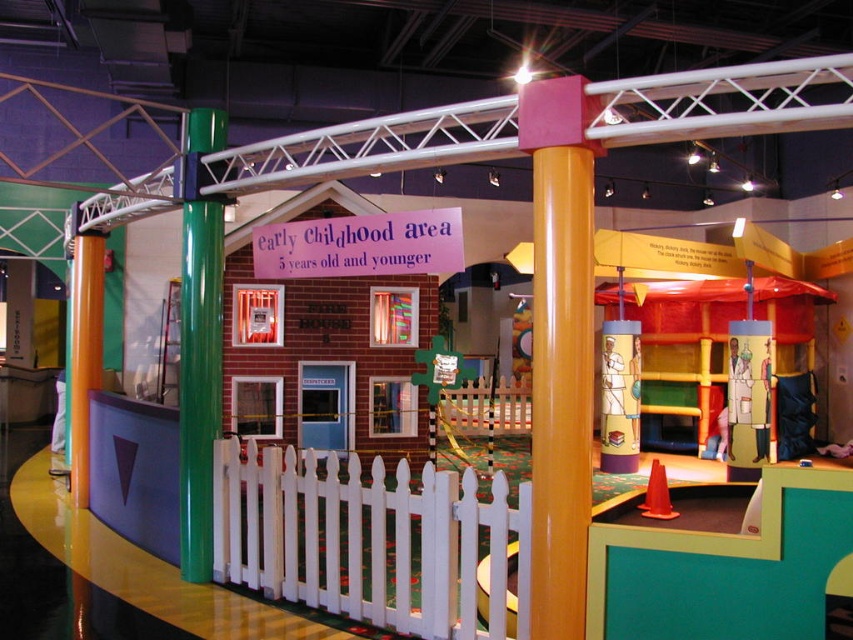
You are standing in the Early Childhood Area and want to find the green glossy pillar at left. According to the map, where is it located?

The green glossy pillar at left is located at the coordinates point (x=199, y=380).

You are a parent trying to decide which column between the green glossy pillar at left and the orange matte column at left your child can hug completely with their arms. Which one would you choose?

The green glossy pillar at left has a lesser width compared to orange matte column at left, so the child can hug the green glossy pillar at left completely with their arms since it is narrower.

You are a parent trying to locate two orange columns in the Early Childhood Area. The columns are labeled as the orange glossy column at center and the orange matte column at left. Which column is positioned higher up compared to the other?

The orange glossy column at center is positioned higher up than the orange matte column at left because it is located above it.